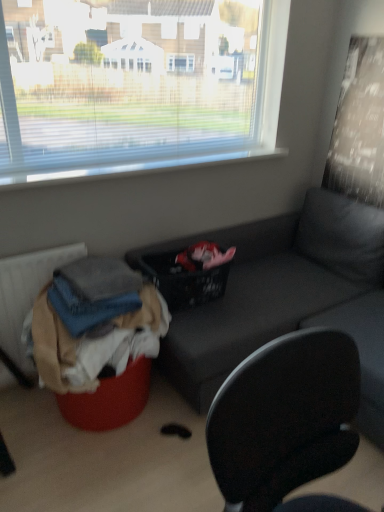
Question: Is the position of black woven basket at center more distant than that of denim fabric clothes at lower left, the second clothing positioned from the top?

Choices:
 (A) no
 (B) yes

Answer: (B)

Question: Is black woven basket at center not within denim fabric clothes at lower left, the second clothing positioned from the top?

Choices:
 (A) yes
 (B) no

Answer: (A)

Question: Does black woven basket at center have a greater width compared to denim fabric clothes at lower left, placed as the 1th clothing when sorted from bottom to top?

Choices:
 (A) no
 (B) yes

Answer: (A)

Question: Is denim fabric clothes at lower left, placed as the 1th clothing when sorted from bottom to top, a part of black woven basket at center?

Choices:
 (A) yes
 (B) no

Answer: (B)

Question: Is black woven basket at center placed right next to denim fabric clothes at lower left, placed as the 1th clothing when sorted from bottom to top?

Choices:
 (A) yes
 (B) no

Answer: (B)

Question: Considering the relative positions of black woven basket at center and denim fabric clothes at lower left, the second clothing positioned from the top, in the image provided, is black woven basket at center to the right of denim fabric clothes at lower left, the second clothing positioned from the top, from the viewer's perspective?

Choices:
 (A) yes
 (B) no

Answer: (A)

Question: Is denim fabric clothes at lower left, the second clothing positioned from the top, to the right of matte gray couch at center from the viewer's perspective?

Choices:
 (A) no
 (B) yes

Answer: (A)

Question: Could you tell me if denim fabric clothes at lower left, the second clothing positioned from the top, is turned towards matte gray couch at center?

Choices:
 (A) yes
 (B) no

Answer: (B)

Question: From a real-world perspective, is denim fabric clothes at lower left, placed as the 1th clothing when sorted from bottom to top, positioned over matte gray couch at center based on gravity?

Choices:
 (A) no
 (B) yes

Answer: (B)

Question: Considering the relative sizes of denim fabric clothes at lower left, the second clothing positioned from the top, and matte gray couch at center in the image provided, is denim fabric clothes at lower left, the second clothing positioned from the top, shorter than matte gray couch at center?

Choices:
 (A) no
 (B) yes

Answer: (B)

Question: Can you confirm if denim fabric clothes at lower left, placed as the 1th clothing when sorted from bottom to top, is positioned to the left of matte gray couch at center?

Choices:
 (A) no
 (B) yes

Answer: (B)

Question: From the image's perspective, is denim fabric clothes at lower left, the second clothing positioned from the top, beneath matte gray couch at center?

Choices:
 (A) yes
 (B) no

Answer: (A)

Question: Is matte gray couch at center facing towards textured fabric radiator at lower left?

Choices:
 (A) no
 (B) yes

Answer: (A)